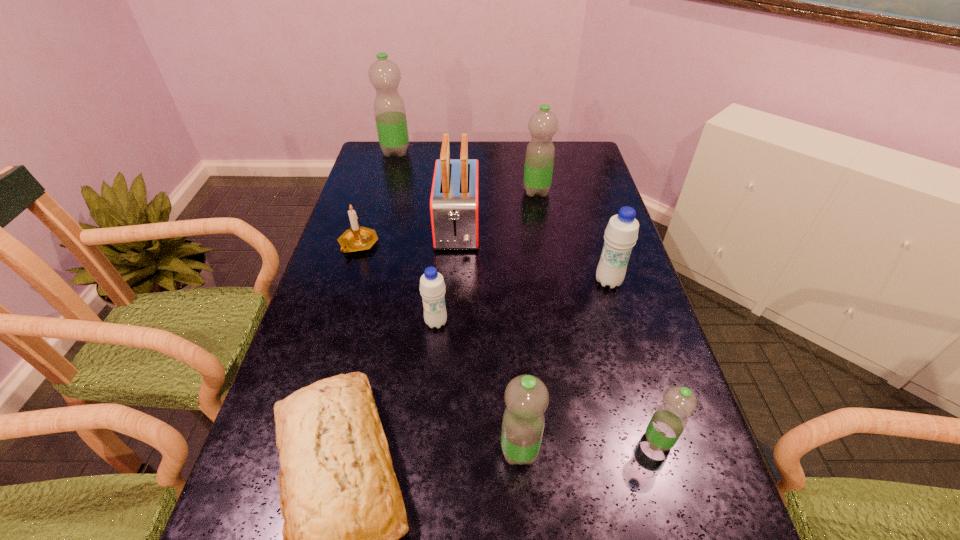
The width and height of the screenshot is (960, 540). Find the location of `vacant space located 0.070m on the right of the gold candle holder`. vacant space located 0.070m on the right of the gold candle holder is located at coordinates (402, 245).

Where is `object that is positioned at the far edge`? object that is positioned at the far edge is located at coordinates click(390, 115).

Find the location of a particular element. water bottle present at the left edge is located at coordinates (390, 115).

Identify the location of candle holder present at the left edge. The width and height of the screenshot is (960, 540). (357, 238).

This screenshot has width=960, height=540. What are the coordinates of `object present at the far left corner` in the screenshot? It's located at coord(390,115).

This screenshot has width=960, height=540. I want to click on vacant space at the far edge, so click(x=521, y=148).

Where is `free space at the left edge of the desktop`? The width and height of the screenshot is (960, 540). free space at the left edge of the desktop is located at coordinates (365, 260).

Locate an element on the screen. The height and width of the screenshot is (540, 960). free space at the right edge is located at coordinates (636, 444).

Identify the location of free space at the far left corner of the desktop. The width and height of the screenshot is (960, 540). (392, 158).

Locate an element on the screen. free space at the far right corner of the desktop is located at coordinates (589, 158).